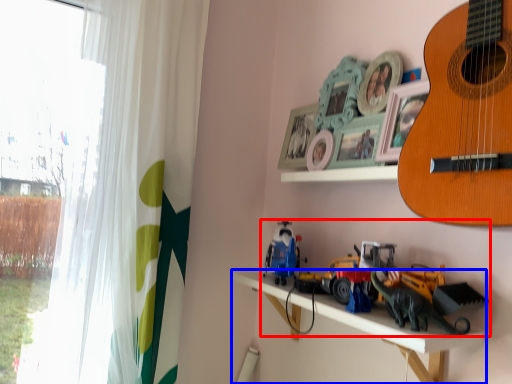
Question: Which of the following is the farthest to the observer, toy (highlighted by a red box) or shelf (highlighted by a blue box)?

Choices:
 (A) toy
 (B) shelf

Answer: (A)